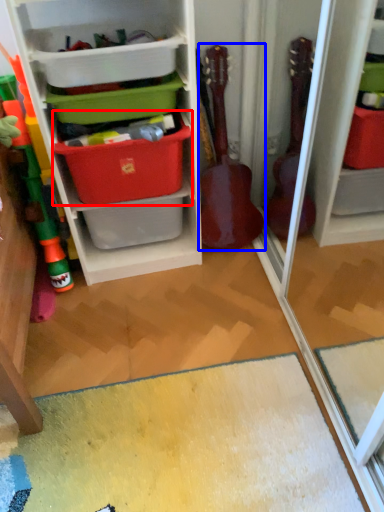
Question: Which object appears closest to the camera in this image, storage box (highlighted by a red box) or guitar (highlighted by a blue box)?

Choices:
 (A) storage box
 (B) guitar

Answer: (A)